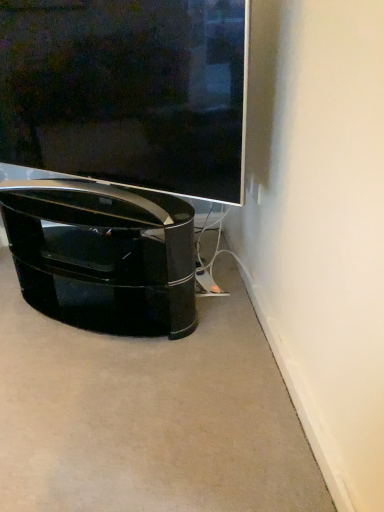
Question: Are matte black tv at center and glossy black tv stand at lower left making contact?

Choices:
 (A) yes
 (B) no

Answer: (B)

Question: Is matte black tv at center looking in the opposite direction of glossy black tv stand at lower left?

Choices:
 (A) no
 (B) yes

Answer: (A)

Question: From the image's perspective, is matte black tv at center under glossy black tv stand at lower left?

Choices:
 (A) yes
 (B) no

Answer: (B)

Question: Is matte black tv at center closer to camera compared to glossy black tv stand at lower left?

Choices:
 (A) no
 (B) yes

Answer: (B)

Question: Is matte black tv at center bigger than glossy black tv stand at lower left?

Choices:
 (A) no
 (B) yes

Answer: (A)

Question: Can glossy black tv stand at lower left be found inside matte black tv at center?

Choices:
 (A) yes
 (B) no

Answer: (B)

Question: Can you confirm if glossy black tv stand at lower left is shorter than matte black tv at center?

Choices:
 (A) no
 (B) yes

Answer: (B)

Question: From the image's perspective, is glossy black tv stand at lower left over matte black tv at center?

Choices:
 (A) yes
 (B) no

Answer: (B)

Question: From the image's perspective, is glossy black tv stand at lower left under matte black tv at center?

Choices:
 (A) yes
 (B) no

Answer: (A)

Question: Is the surface of glossy black tv stand at lower left in direct contact with matte black tv at center?

Choices:
 (A) yes
 (B) no

Answer: (B)

Question: Considering the relative sizes of glossy black tv stand at lower left and matte black tv at center in the image provided, is glossy black tv stand at lower left bigger than matte black tv at center?

Choices:
 (A) no
 (B) yes

Answer: (B)

Question: Can you confirm if glossy black tv stand at lower left is positioned to the left of matte black tv at center?

Choices:
 (A) no
 (B) yes

Answer: (B)

Question: Would you say glossy black tv stand at lower left is to the left or to the right of matte black tv at center in the picture?

Choices:
 (A) right
 (B) left

Answer: (B)